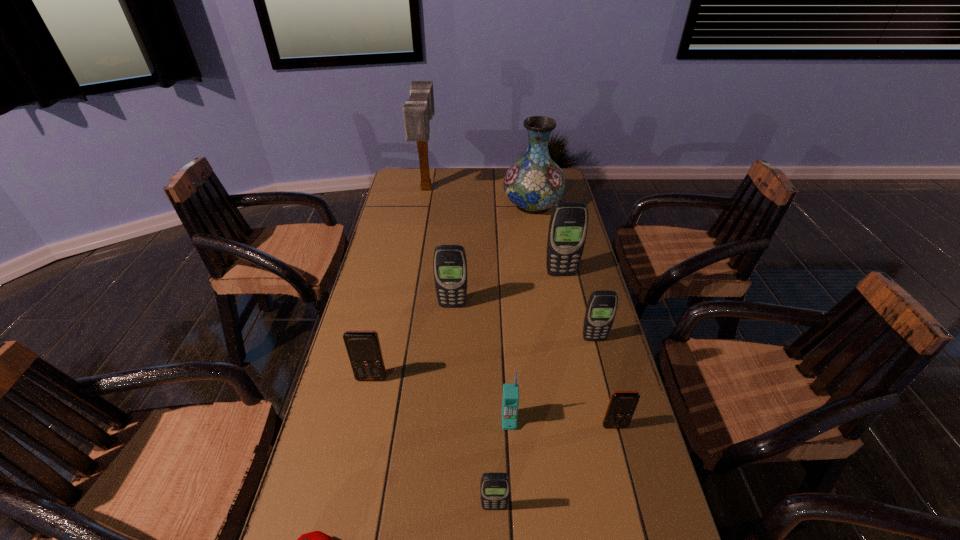
At what (x,y) coordinates should I click in order to perform the action: click on blank area located on the screen of the farther orange cellular telephone. Please return your answer as a coordinate pair (x, y). Looking at the image, I should click on (346, 498).

Where is `free space located 0.180m on the screen of the nearer orange cellular telephone`? This screenshot has width=960, height=540. free space located 0.180m on the screen of the nearer orange cellular telephone is located at coordinates (636, 510).

Locate an element on the screen. The image size is (960, 540). mallet situated at the far edge is located at coordinates (419, 109).

The height and width of the screenshot is (540, 960). I want to click on vase that is at the far edge, so click(x=534, y=183).

Locate an element on the screen. Image resolution: width=960 pixels, height=540 pixels. mallet that is positioned at the left edge is located at coordinates (419, 109).

This screenshot has width=960, height=540. In order to click on cellular telephone positioned at the left edge in this screenshot , I will do `click(364, 351)`.

Where is `vase located at the right edge`? The image size is (960, 540). vase located at the right edge is located at coordinates (534, 183).

This screenshot has width=960, height=540. Find the location of `object located in the far left corner section of the desktop`. object located in the far left corner section of the desktop is located at coordinates (419, 109).

At what (x,y) coordinates should I click in order to perform the action: click on object located in the far right corner section of the desktop. Please return your answer as a coordinate pair (x, y). The height and width of the screenshot is (540, 960). Looking at the image, I should click on (534, 183).

This screenshot has width=960, height=540. Find the location of `vacant area at the far edge`. vacant area at the far edge is located at coordinates point(498,193).